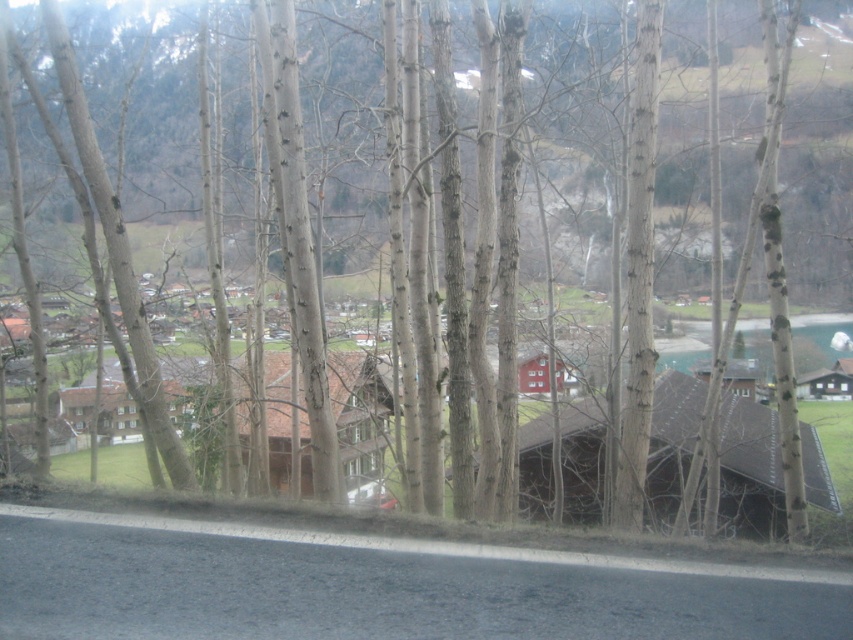
Question: Does brown wooden hut at center-right have a larger size compared to brown wooden house at center?

Choices:
 (A) yes
 (B) no

Answer: (A)

Question: Can you confirm if brown wooden hut at center-right is smaller than brown wooden house at center?

Choices:
 (A) no
 (B) yes

Answer: (A)

Question: Which point is farther to the camera?

Choices:
 (A) brown wooden house at center
 (B) transparent glass car window at lower center
 (C) brown wooden hut at center-right
 (D) matte red house at center

Answer: (D)

Question: Can you confirm if brown wooden house at center is thinner than matte red house at center?

Choices:
 (A) yes
 (B) no

Answer: (A)

Question: Which point appears closest to the camera in this image?

Choices:
 (A) (540, 358)
 (B) (366, 458)
 (C) (544, 468)

Answer: (B)

Question: Which point appears closest to the camera in this image?

Choices:
 (A) (367, 486)
 (B) (339, 355)
 (C) (773, 451)

Answer: (A)